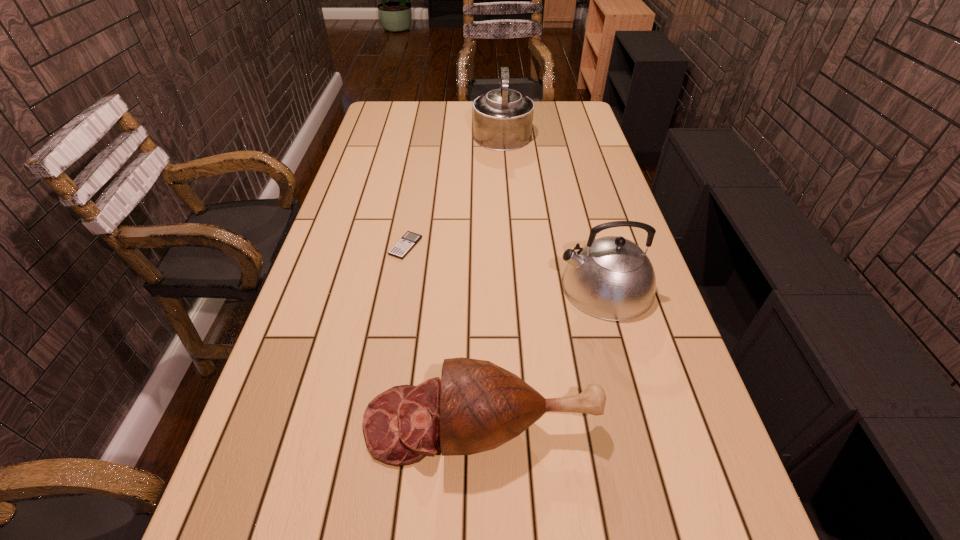
You are a GUI agent. You are given a task and a screenshot of the screen. Output one action in this format:
    pyautogui.click(x=<x>, y=<y>)
    Task: Click on the vacant space situated 0.130m from the spout of the shorter kettle
    The image size is (960, 540).
    Given the screenshot: What is the action you would take?
    pyautogui.click(x=509, y=286)

Where is `vacant area located at the sliced end of the second shortest object`? vacant area located at the sliced end of the second shortest object is located at coordinates (315, 423).

I want to click on vacant region located at the sliced end of the second shortest object, so click(280, 423).

This screenshot has height=540, width=960. What are the coordinates of `free spot located at the sliced end of the second shortest object` in the screenshot? It's located at (290, 423).

Locate an element on the screen. The image size is (960, 540). blank space located 0.070m on the right of the calculator is located at coordinates (445, 246).

The image size is (960, 540). I want to click on object positioned at the far edge, so (502, 118).

Identify the location of object present at the right edge. (611, 278).

Locate an element on the screen. The width and height of the screenshot is (960, 540). free space at the far edge of the desktop is located at coordinates (414, 121).

You are a GUI agent. You are given a task and a screenshot of the screen. Output one action in this format:
    pyautogui.click(x=<x>, y=<y>)
    Task: Click on the free space at the left edge
    
    Given the screenshot: What is the action you would take?
    pyautogui.click(x=353, y=193)

Identify the location of free space at the right edge of the desktop. This screenshot has width=960, height=540. (665, 336).